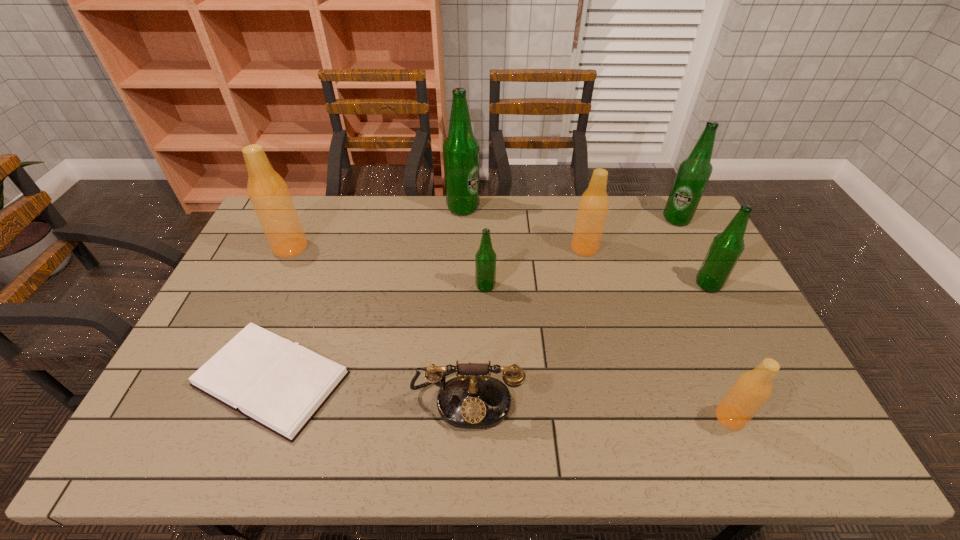
The image size is (960, 540). Identify the location of free region located 0.360m on the label of the second smallest green beer bottle. (581, 285).

Locate an element on the screen. This screenshot has width=960, height=540. vacant point located 0.120m on the right of the second smallest tan beer bottle is located at coordinates (634, 248).

Locate an element on the screen. The width and height of the screenshot is (960, 540). free space located 0.060m on the label of the smallest green beer bottle is located at coordinates (456, 286).

Locate an element on the screen. Image resolution: width=960 pixels, height=540 pixels. free point located 0.070m on the label of the smallest green beer bottle is located at coordinates (453, 286).

Find the location of `free point located on the label of the smallest green beer bottle`. free point located on the label of the smallest green beer bottle is located at coordinates (399, 286).

This screenshot has width=960, height=540. Find the location of `free space located 0.200m on the left of the fifth beer bottle from left to right`. free space located 0.200m on the left of the fifth beer bottle from left to right is located at coordinates (634, 417).

Find the location of a particular element. vacant region located 0.190m on the back of the shortest object is located at coordinates (309, 280).

Where is `beer bottle present at the near edge`? beer bottle present at the near edge is located at coordinates (751, 390).

Find the location of a particular element. Image resolution: width=960 pixels, height=540 pixels. telephone located at the near edge is located at coordinates (473, 400).

At what (x,y) coordinates should I click in order to perform the action: click on hardback book that is at the near edge. Please return your answer as a coordinate pair (x, y). This screenshot has height=540, width=960. Looking at the image, I should click on (280, 385).